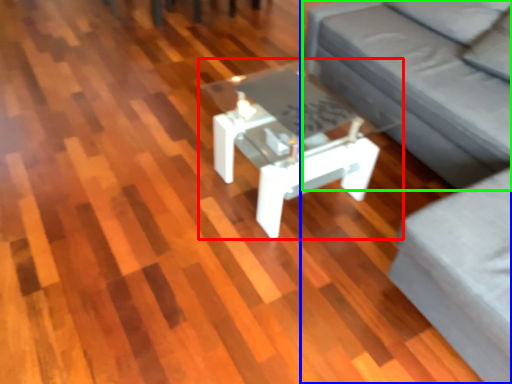
Question: Which object is positioned closest to coffee table (highlighted by a red box)? Select from studio couch (highlighted by a blue box) and couch (highlighted by a green box).

Choices:
 (A) studio couch
 (B) couch

Answer: (B)